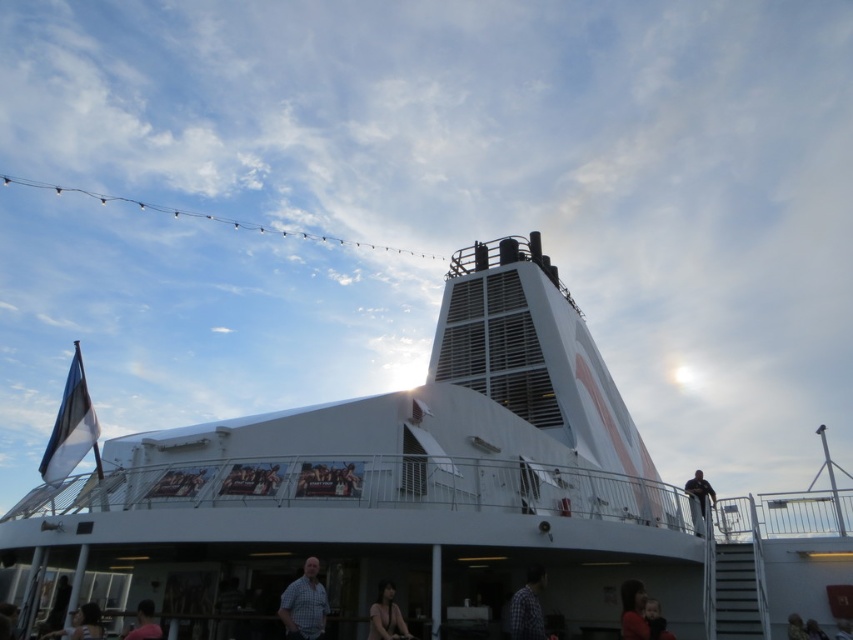
Question: Which object appears farthest from the camera in this image?

Choices:
 (A) plaid shirt at lower center
 (B) smooth skin at lower center
 (C) matte pink shirt at lower left

Answer: (B)

Question: Is matte red shirt at lower right behind black fuzzy coat at lower right?

Choices:
 (A) no
 (B) yes

Answer: (B)

Question: Can you confirm if checkered shirt at lower center is positioned below smooth skin face at lower center?

Choices:
 (A) no
 (B) yes

Answer: (A)

Question: Estimate the real-world distances between objects in this image. Which object is farther from the white matte boat at center?

Choices:
 (A) smooth skin at lower center
 (B) plaid shirt at lower center
 (C) dark brown hair at lower right

Answer: (C)

Question: Observing the image, what is the correct spatial positioning of smooth skin at lower center in reference to matte red shirt at lower right?

Choices:
 (A) above
 (B) below

Answer: (A)

Question: Which of the following is the farthest from the observer?

Choices:
 (A) (384, 634)
 (B) (788, 627)
 (C) (689, 509)

Answer: (C)